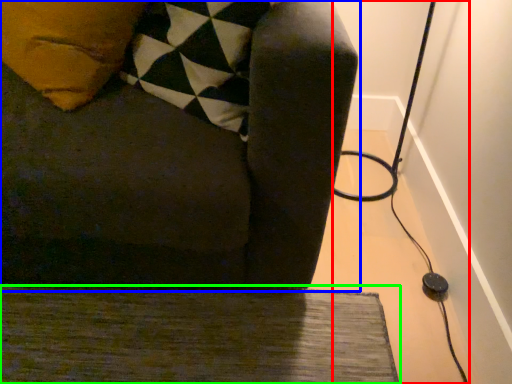
Question: Considering the real-world distances, which object is closest to cable (highlighted by a red box)? furniture (highlighted by a blue box) or doormat (highlighted by a green box).

Choices:
 (A) furniture
 (B) doormat

Answer: (B)